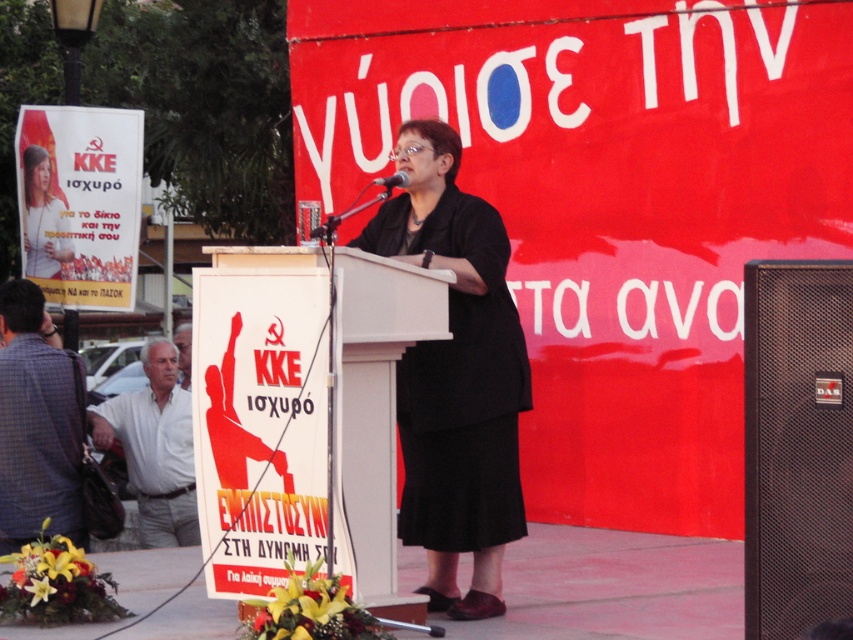
Question: Estimate the real-world distances between objects in this image. Which object is closer to the black matte dress at center?

Choices:
 (A) matte black dress at center
 (B) white wood podium at center

Answer: (B)

Question: Can you confirm if white wood podium at center is positioned above matte black microphone at center?

Choices:
 (A) no
 (B) yes

Answer: (A)

Question: Based on their relative distances, which object is nearer to the black mesh speaker at center?

Choices:
 (A) matte black microphone at center
 (B) black matte dress at center
 (C) white wood podium at center
 (D) matte black dress at center

Answer: (B)

Question: Is black matte dress at center closer to camera compared to matte black dress at center?

Choices:
 (A) no
 (B) yes

Answer: (B)

Question: Which object is closer to the camera taking this photo?

Choices:
 (A) white wood podium at center
 (B) matte black microphone at center

Answer: (A)

Question: Does black mesh speaker at center have a lesser width compared to black matte dress at center?

Choices:
 (A) no
 (B) yes

Answer: (B)